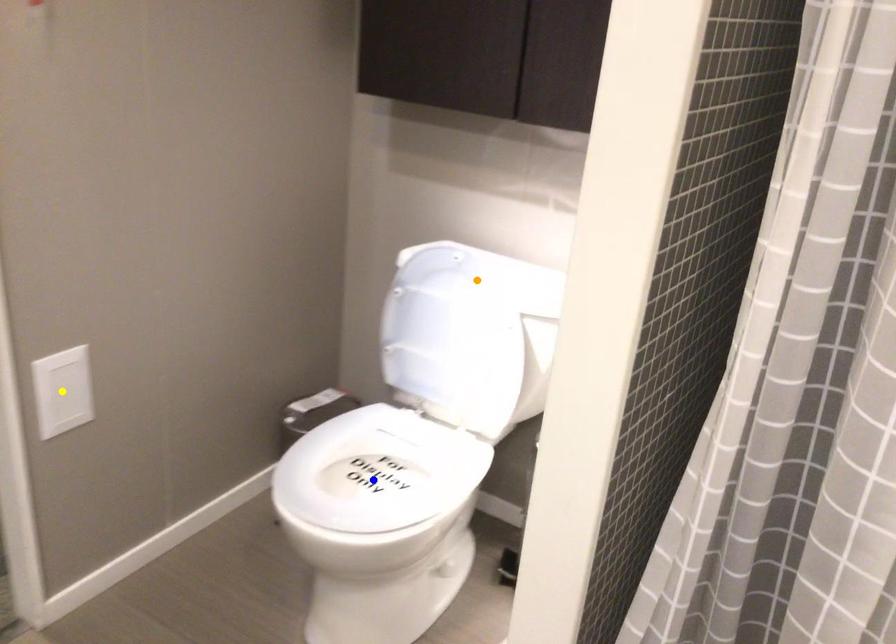
In the scene shown: Order these from nearest to farthest:
orange point, yellow point, blue point

1. yellow point
2. orange point
3. blue point